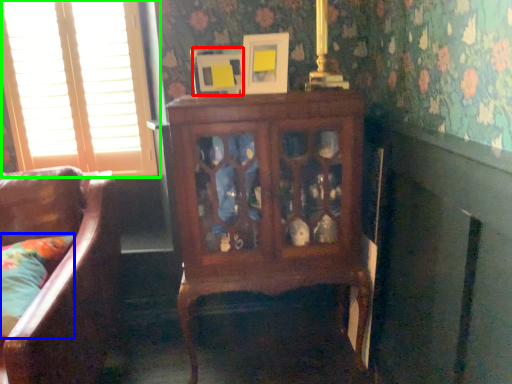
Question: Which object is the farthest from picture frame (highlighted by a red box)? Choose among these: pillow (highlighted by a blue box) or window (highlighted by a green box).

Choices:
 (A) pillow
 (B) window

Answer: (A)